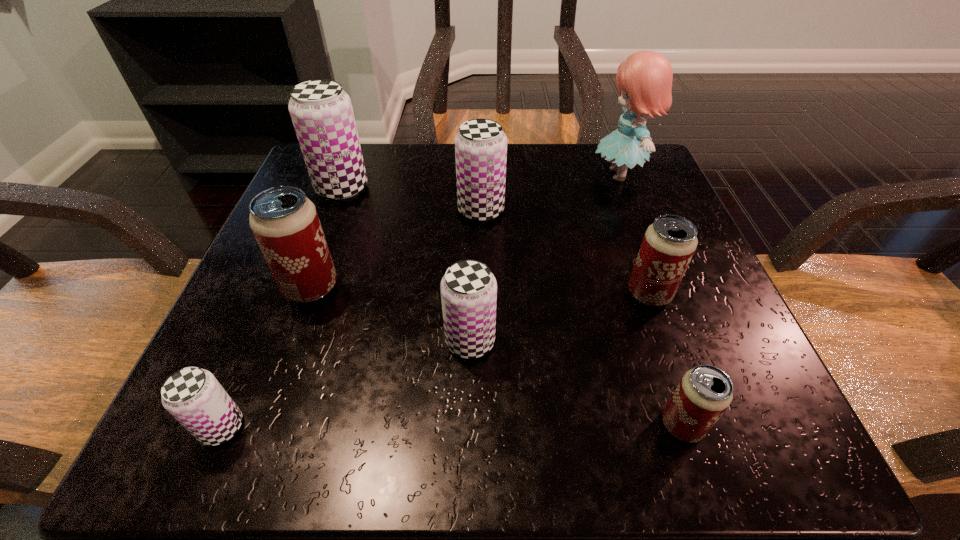
Where is `blank space at the right edge of the desktop`? The image size is (960, 540). blank space at the right edge of the desktop is located at coordinates (686, 334).

Locate an element on the screen. blank space at the far left corner of the desktop is located at coordinates (373, 167).

What are the coordinates of `vacant area at the far right corner of the desktop` in the screenshot? It's located at (604, 201).

Locate an element on the screen. The image size is (960, 540). vacant space at the near right corner of the desktop is located at coordinates (725, 443).

This screenshot has width=960, height=540. I want to click on free area in between the second tallest object and the second smallest red beer can, so click(495, 241).

I want to click on free area in between the second biggest purple beer can and the second biggest red beer can, so click(565, 252).

This screenshot has height=540, width=960. Find the location of `empty space between the third smallest purple beer can and the second smallest red beer can`. empty space between the third smallest purple beer can and the second smallest red beer can is located at coordinates (565, 252).

In order to click on blank region between the second smallest red beer can and the tallest beer can in this screenshot , I will do `click(495, 241)`.

Where is `vacant space in between the biggest red beer can and the nearest purple beer can`? Image resolution: width=960 pixels, height=540 pixels. vacant space in between the biggest red beer can and the nearest purple beer can is located at coordinates (266, 357).

Image resolution: width=960 pixels, height=540 pixels. I want to click on vacant region between the biggest purple beer can and the third biggest purple beer can, so click(406, 265).